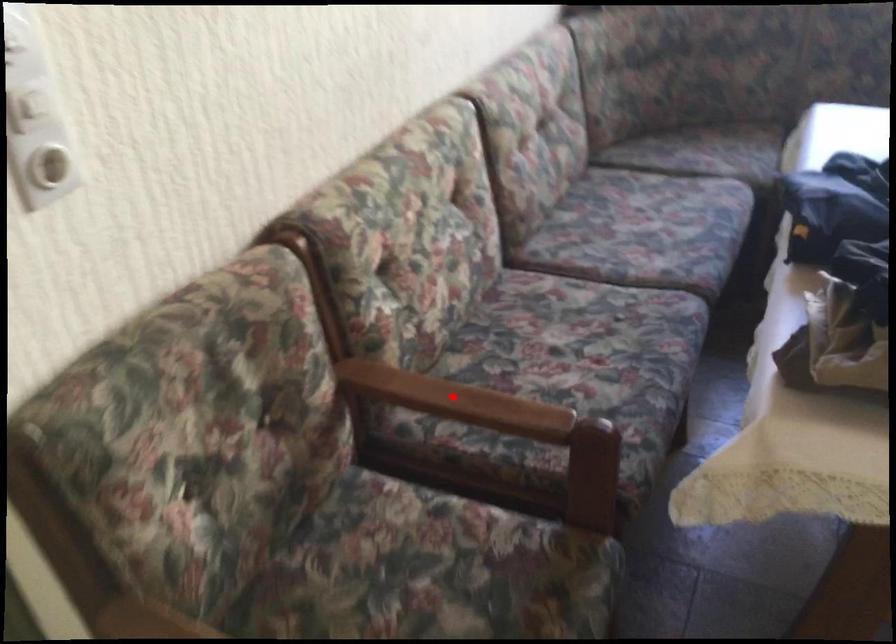
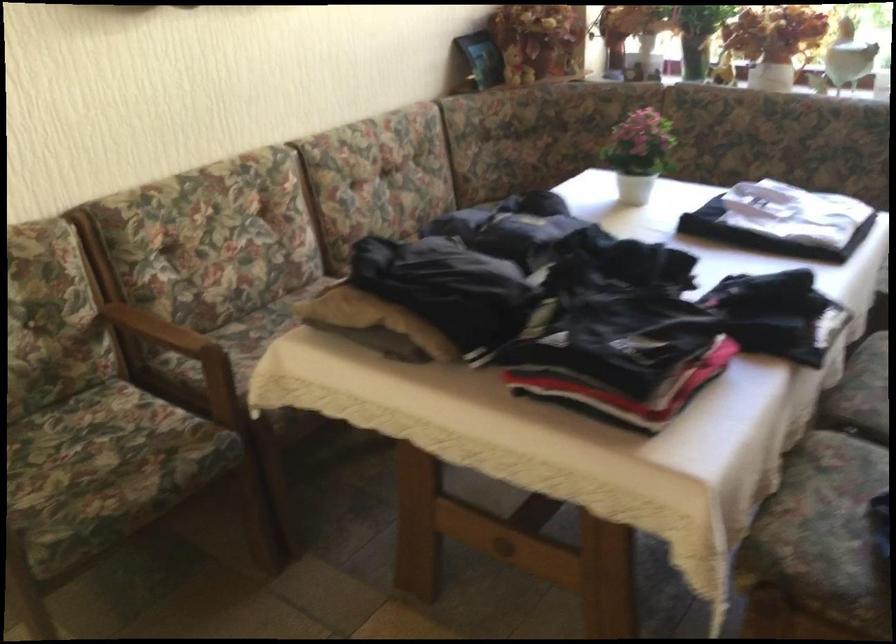
Question: A red point is marked in image1. In image2, is the corresponding 3D point closer to the camera or farther? Reply with the corresponding letter.

Choices:
 (A) The corresponding 3D point is closer.
 (B) The corresponding 3D point is farther.

Answer: (B)